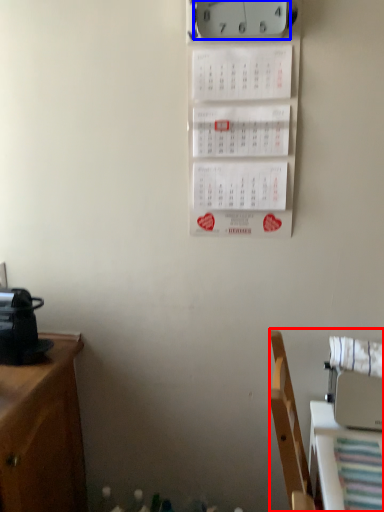
Question: Among these objects, which one is nearest to the camera, furniture (highlighted by a red box) or clock (highlighted by a blue box)?

Choices:
 (A) furniture
 (B) clock

Answer: (A)